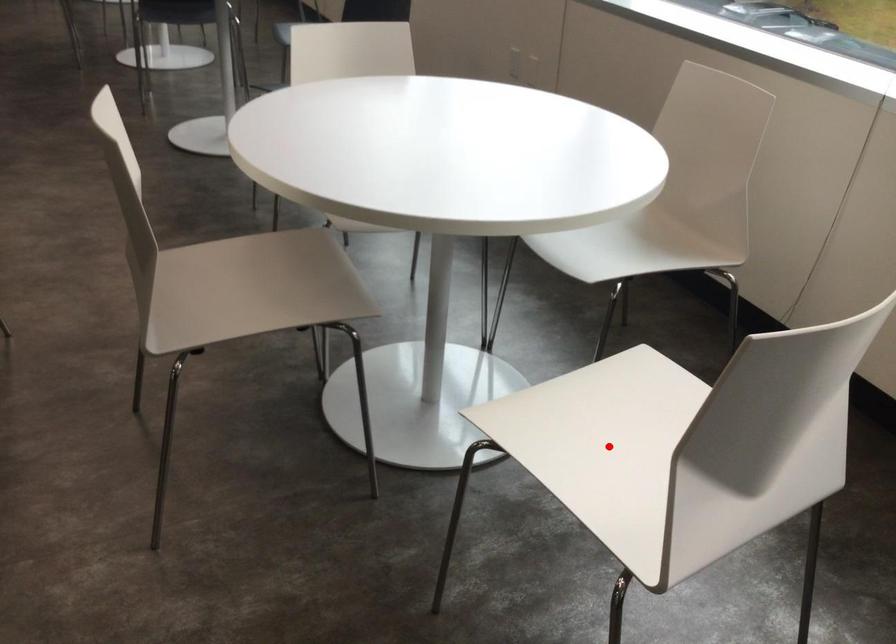
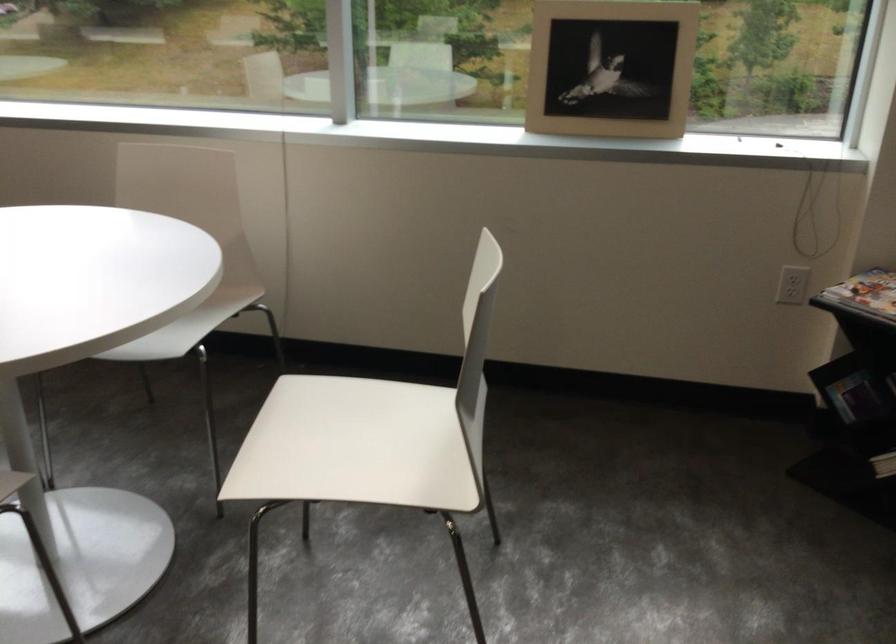
Question: A red point is marked in image1. In image2, is the corresponding 3D point closer to the camera or farther? Reply with the corresponding letter.

Choices:
 (A) The corresponding 3D point is closer.
 (B) The corresponding 3D point is farther.

Answer: (B)